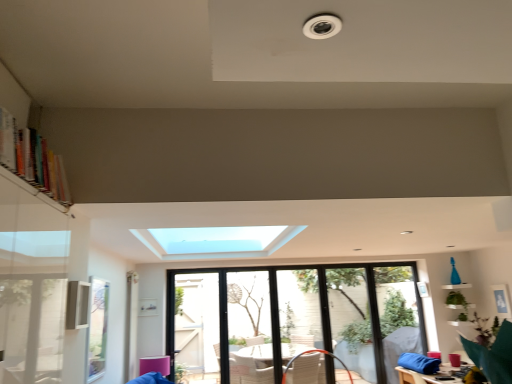
Question: Does multicolored wooden bookshelf at upper left have a smaller size compared to clear glass window at center?

Choices:
 (A) yes
 (B) no

Answer: (A)

Question: Is multicolored wooden bookshelf at upper left closer to the viewer compared to clear glass window at center?

Choices:
 (A) no
 (B) yes

Answer: (B)

Question: Is multicolored wooden bookshelf at upper left bigger than clear glass window at center?

Choices:
 (A) no
 (B) yes

Answer: (A)

Question: From the image's perspective, is multicolored wooden bookshelf at upper left on clear glass window at center?

Choices:
 (A) yes
 (B) no

Answer: (A)

Question: From the image's perspective, is multicolored wooden bookshelf at upper left below clear glass window at center?

Choices:
 (A) no
 (B) yes

Answer: (A)

Question: From a real-world perspective, is multicolored wooden bookshelf at upper left physically located above or below clear glass window at center?

Choices:
 (A) below
 (B) above

Answer: (B)

Question: From the image's perspective, is multicolored wooden bookshelf at upper left located above or below clear glass window at center?

Choices:
 (A) above
 (B) below

Answer: (A)

Question: In terms of width, does multicolored wooden bookshelf at upper left look wider or thinner when compared to clear glass window at center?

Choices:
 (A) wide
 (B) thin

Answer: (A)

Question: Visually, is multicolored wooden bookshelf at upper left positioned to the left or to the right of clear glass window at center?

Choices:
 (A) right
 (B) left

Answer: (B)

Question: In the image, is clear glass window screen at lower left positioned in front of or behind transparent glass screen door at center, the first screen door in the left-to-right sequence?

Choices:
 (A) behind
 (B) front

Answer: (B)

Question: Is clear glass window screen at lower left spatially inside transparent glass screen door at center, the first screen door in the left-to-right sequence, or outside of it?

Choices:
 (A) inside
 (B) outside

Answer: (B)

Question: Considering the positions of clear glass window screen at lower left and transparent glass screen door at center, the first screen door in the left-to-right sequence, in the image, is clear glass window screen at lower left bigger or smaller than transparent glass screen door at center, the first screen door in the left-to-right sequence,?

Choices:
 (A) big
 (B) small

Answer: (B)

Question: Is clear glass window screen at lower left wider or thinner than transparent glass screen door at center, the first screen door in the left-to-right sequence?

Choices:
 (A) thin
 (B) wide

Answer: (A)

Question: Relative to clear glass window at center, is transparent glass screen door at center, which appears as the 2th screen door when viewed from the left, in front or behind?

Choices:
 (A) front
 (B) behind

Answer: (B)

Question: From the image's perspective, relative to clear glass window at center, is transparent glass screen door at center, which appears as the 2th screen door when viewed from the left, above or below?

Choices:
 (A) above
 (B) below

Answer: (A)